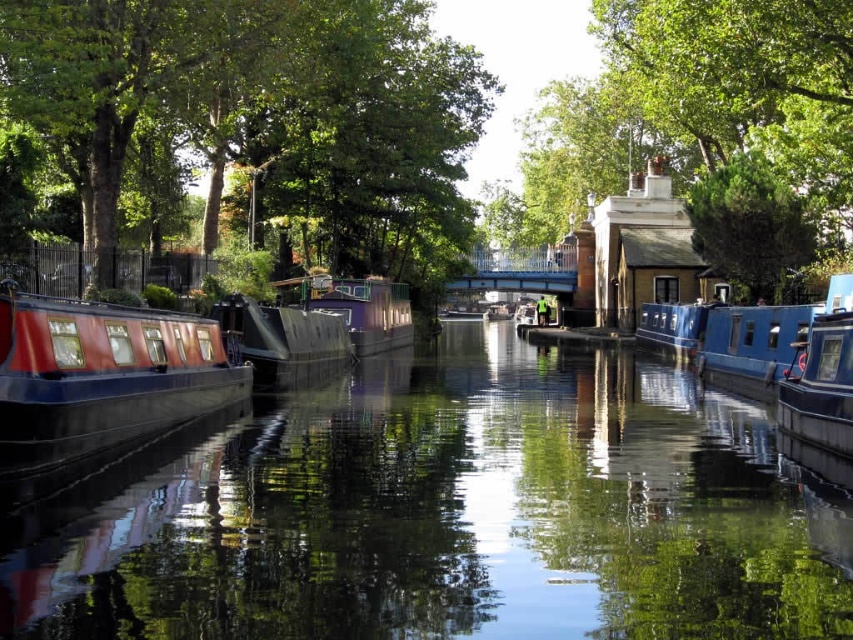
Question: Can you confirm if smooth water at center is thinner than purple matte boat at center?

Choices:
 (A) no
 (B) yes

Answer: (A)

Question: Can you confirm if smooth water at center is thinner than green leafy tree at center?

Choices:
 (A) yes
 (B) no

Answer: (A)

Question: Among these points, which one is nearest to the camera?

Choices:
 (A) (471, 472)
 (B) (740, 189)
 (C) (381, 323)

Answer: (A)

Question: Which point is closer to the camera taking this photo?

Choices:
 (A) (711, 323)
 (B) (264, 339)
 (C) (799, 362)
 (D) (399, 342)

Answer: (C)

Question: Does blue glossy canal boat at right come in front of matte black barge at center?

Choices:
 (A) yes
 (B) no

Answer: (A)

Question: Which object appears closest to the camera in this image?

Choices:
 (A) blue glossy barge at right
 (B) green leafy tree at upper right
 (C) matte red barge at left
 (D) blue glossy barge at center-right

Answer: (C)